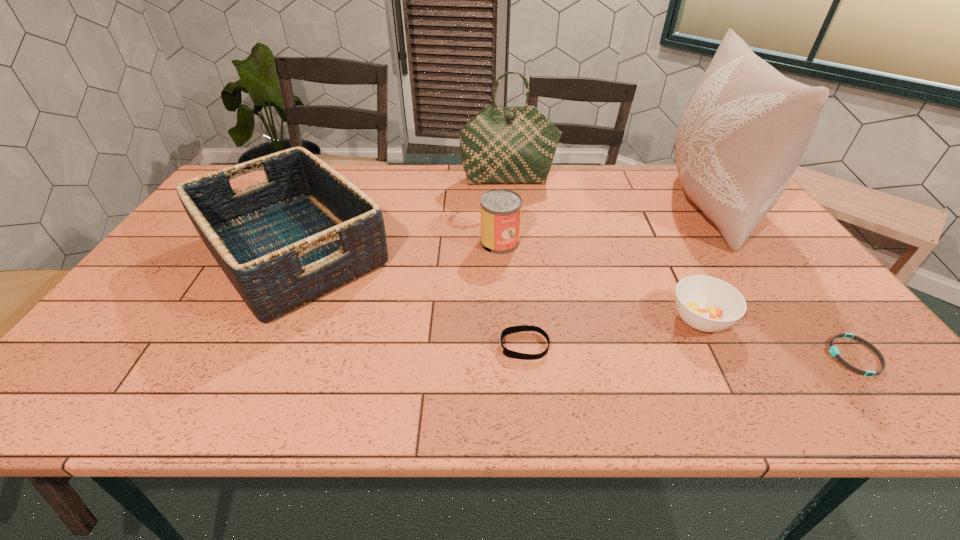
Find the location of `blank space located 0.220m on the front side of the tallest object`. blank space located 0.220m on the front side of the tallest object is located at coordinates (597, 206).

Where is `vacant space located 0.160m on the front side of the tallest object`? vacant space located 0.160m on the front side of the tallest object is located at coordinates (616, 206).

Locate an element on the screen. Image resolution: width=960 pixels, height=540 pixels. free space located 0.290m on the front side of the tallest object is located at coordinates (576, 206).

In order to click on vacant space located 0.100m on the left of the tote bag in this screenshot , I will do `click(432, 180)`.

Where is `vacant space positioned 0.100m on the front of the third tallest object`? This screenshot has width=960, height=540. vacant space positioned 0.100m on the front of the third tallest object is located at coordinates (238, 363).

You are a GUI agent. You are given a task and a screenshot of the screen. Output one action in this format:
    pyautogui.click(x=<x>, y=<y>)
    Task: Click on the vacant region located 0.270m on the back of the can
    The height and width of the screenshot is (540, 960).
    Given the screenshot: What is the action you would take?
    pyautogui.click(x=496, y=184)

I want to click on blank space located 0.190m on the left of the soup bowl, so click(x=589, y=319).

The image size is (960, 540). Find the location of `free point located 0.180m on the display of the second shortest object`. free point located 0.180m on the display of the second shortest object is located at coordinates (420, 346).

This screenshot has height=540, width=960. I want to click on vacant region located on the display of the second shortest object, so click(x=464, y=346).

This screenshot has width=960, height=540. In order to click on vacant space situated 0.070m on the display of the second shortest object in this screenshot , I will do `click(468, 346)`.